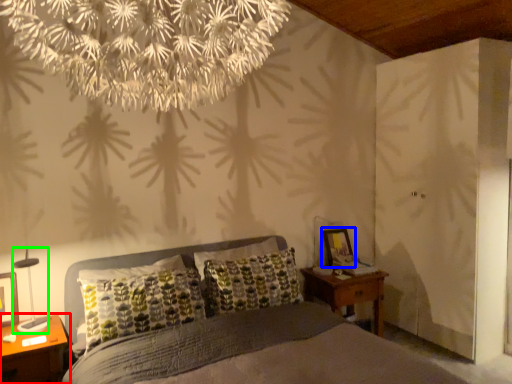
Question: Estimate the real-world distances between objects in this image. Which object is closer to nightstand (highlighted by a red box), picture frame (highlighted by a blue box) or bedside lamp (highlighted by a green box)?

Choices:
 (A) picture frame
 (B) bedside lamp

Answer: (B)